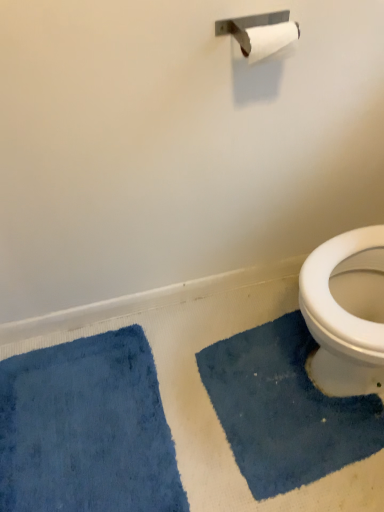
Where is `empty space that is to the right of blue plush bath mat at lower left, placed as the 1th bath mat when sorted from left to right`? This screenshot has width=384, height=512. empty space that is to the right of blue plush bath mat at lower left, placed as the 1th bath mat when sorted from left to right is located at coordinates (236, 408).